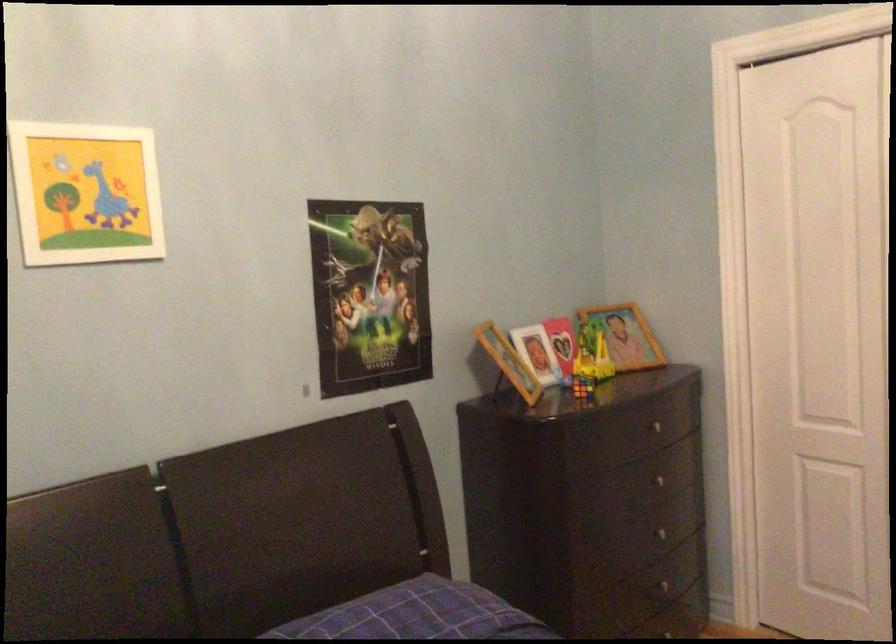
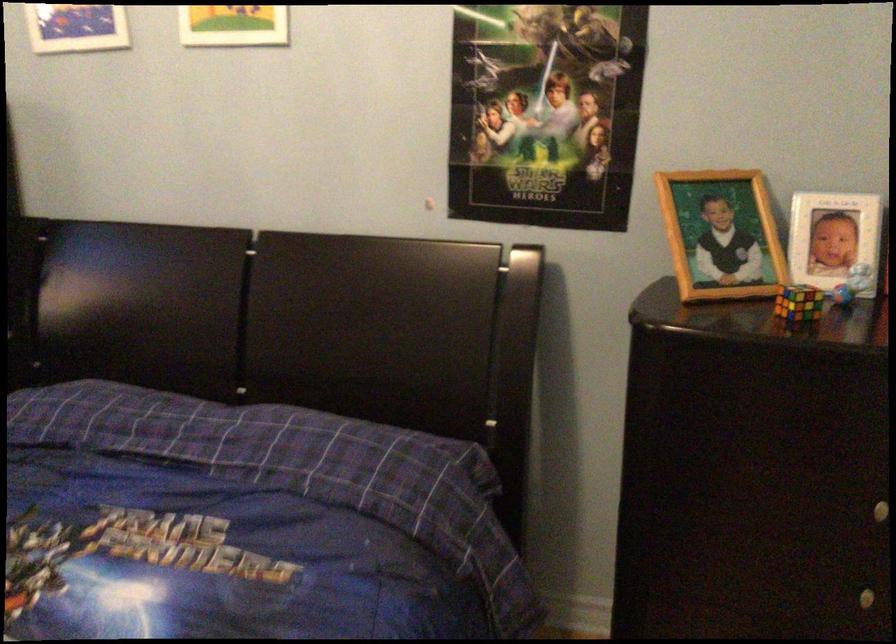
Locate, in the second image, the point that corresponds to (666,538) in the first image.

(868, 597)